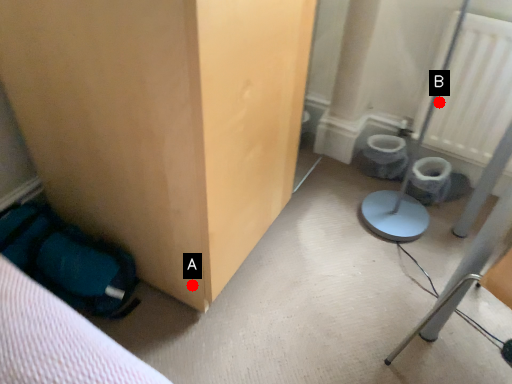
Question: Two points are circled on the image, labeled by A and B beside each circle. Which point is farther from the camera taking this photo?

Choices:
 (A) A is further
 (B) B is further

Answer: (B)